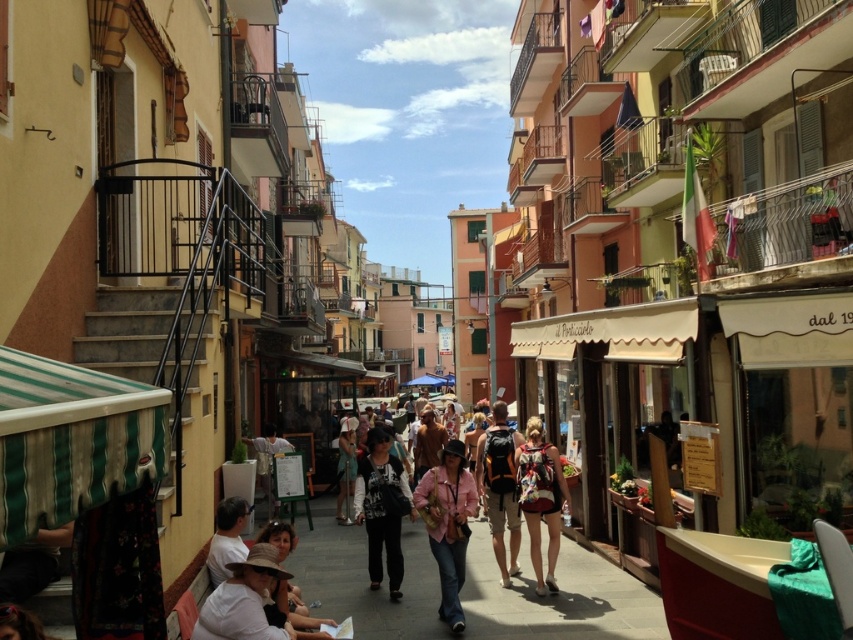
Can you confirm if dark gray fabric pants at center is taller than matte brown hat at lower left?

Yes.

Who is lower down, dark gray fabric pants at center or matte brown hat at lower left?

dark gray fabric pants at center

Who is more forward, (x=381, y=477) or (x=300, y=625)?

Point (x=300, y=625) is more forward.

The image size is (853, 640). In order to click on dark gray fabric pants at center in this screenshot , I will do `click(381, 508)`.

Who is positioned more to the right, matte brown hat at lower left or light brown leather jacket at center?

Positioned to the right is light brown leather jacket at center.

Does matte brown hat at lower left appear under light brown leather jacket at center?

No, matte brown hat at lower left is not below light brown leather jacket at center.

Does point (279, 552) lie in front of point (444, 429)?

Yes, it is in front of point (444, 429).

At what (x,y) coordinates should I click in order to perform the action: click on matte brown hat at lower left. Please return your answer as a coordinate pair (x, y). This screenshot has height=640, width=853. Looking at the image, I should click on (289, 612).

The height and width of the screenshot is (640, 853). Describe the element at coordinates (541, 499) in the screenshot. I see `red backpack at center` at that location.

Locate an element on the screen. red backpack at center is located at coordinates (541, 499).

This screenshot has height=640, width=853. I want to click on red backpack at center, so click(x=541, y=499).